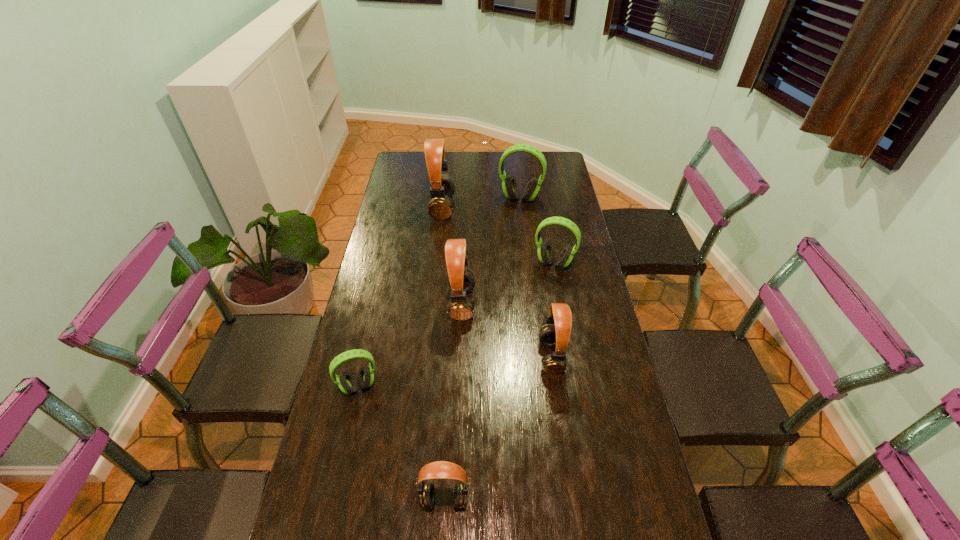
Find the location of a particular element. Image resolution: width=960 pixels, height=540 pixels. the farthest brown headset is located at coordinates (440, 205).

Where is `the biggest brown headset`? This screenshot has height=540, width=960. the biggest brown headset is located at coordinates (440, 205).

Find the location of a particular element. The height and width of the screenshot is (540, 960). the second biggest brown headset is located at coordinates (461, 280).

Where is `the fourth farthest headset`? The width and height of the screenshot is (960, 540). the fourth farthest headset is located at coordinates (461, 280).

The width and height of the screenshot is (960, 540). What are the coordinates of `the farthest green headset` in the screenshot? It's located at (510, 187).

What are the coordinates of `the second biggest green headset` in the screenshot? It's located at (545, 251).

I want to click on the fifth nearest object, so click(x=545, y=251).

Where is `the third biggest brown headset`? The height and width of the screenshot is (540, 960). the third biggest brown headset is located at coordinates (558, 335).

This screenshot has width=960, height=540. I want to click on the third farthest brown headset, so click(558, 335).

Identify the location of the leftmost object. (347, 384).